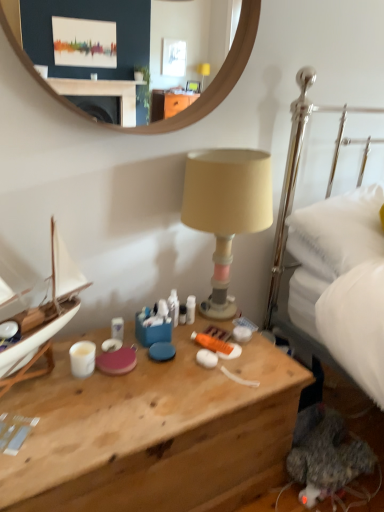
Question: Does wooden desk at center have a greater width compared to white glossy coffee cup at lower left?

Choices:
 (A) yes
 (B) no

Answer: (A)

Question: Are wooden desk at center and white glossy coffee cup at lower left beside each other?

Choices:
 (A) no
 (B) yes

Answer: (A)

Question: Is wooden desk at center not near white glossy coffee cup at lower left?

Choices:
 (A) no
 (B) yes

Answer: (A)

Question: Does wooden desk at center have a lesser height compared to white glossy coffee cup at lower left?

Choices:
 (A) yes
 (B) no

Answer: (B)

Question: Considering the relative positions of wooden desk at center and white glossy coffee cup at lower left in the image provided, is wooden desk at center to the right of white glossy coffee cup at lower left from the viewer's perspective?

Choices:
 (A) no
 (B) yes

Answer: (B)

Question: From a real-world perspective, relative to white plastic tube at center, is wooden mirror at upper center vertically above or below?

Choices:
 (A) above
 (B) below

Answer: (A)

Question: Is wooden mirror at upper center in front of or behind white plastic tube at center in the image?

Choices:
 (A) front
 (B) behind

Answer: (A)

Question: Considering the positions of point (77, 71) and point (190, 300), is point (77, 71) closer or farther from the camera than point (190, 300)?

Choices:
 (A) closer
 (B) farther

Answer: (A)

Question: Is wooden mirror at upper center taller or shorter than white plastic tube at center?

Choices:
 (A) short
 (B) tall

Answer: (B)

Question: Visually, is white glossy coffee cup at lower left positioned to the left or to the right of wooden mirror at upper center?

Choices:
 (A) left
 (B) right

Answer: (A)

Question: Considering the positions of point (84, 374) and point (150, 60), is point (84, 374) closer or farther from the camera than point (150, 60)?

Choices:
 (A) farther
 (B) closer

Answer: (B)

Question: From a real-world perspective, is white glossy coffee cup at lower left physically located above or below wooden mirror at upper center?

Choices:
 (A) above
 (B) below

Answer: (B)

Question: Considering their positions, is white glossy coffee cup at lower left located in front of or behind wooden mirror at upper center?

Choices:
 (A) behind
 (B) front

Answer: (A)

Question: From the image's perspective, is wooden mirror at upper center located above or below wooden desk at center?

Choices:
 (A) above
 (B) below

Answer: (A)

Question: Looking at their shapes, would you say wooden mirror at upper center is wider or thinner than wooden desk at center?

Choices:
 (A) wide
 (B) thin

Answer: (B)